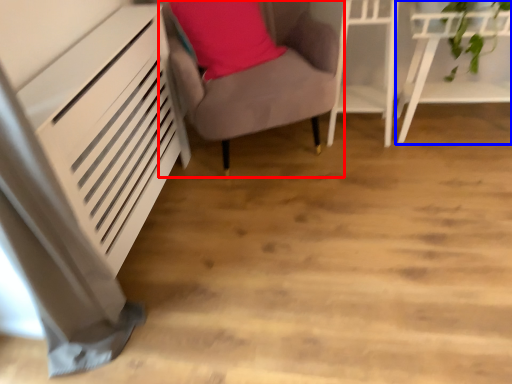
Question: Which of the following is the closest to the observer, furniture (highlighted by a red box) or furniture (highlighted by a blue box)?

Choices:
 (A) furniture
 (B) furniture

Answer: (A)